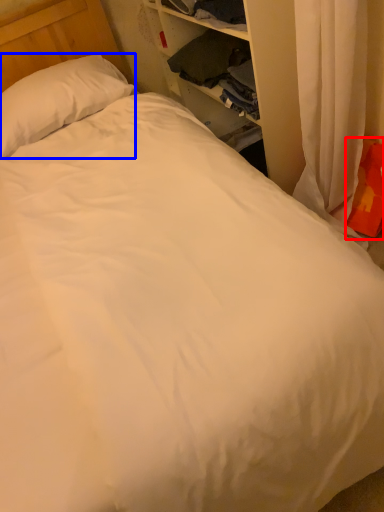
Question: Which object is closer to the camera taking this photo, pillow (highlighted by a red box) or pillow (highlighted by a blue box)?

Choices:
 (A) pillow
 (B) pillow

Answer: (A)